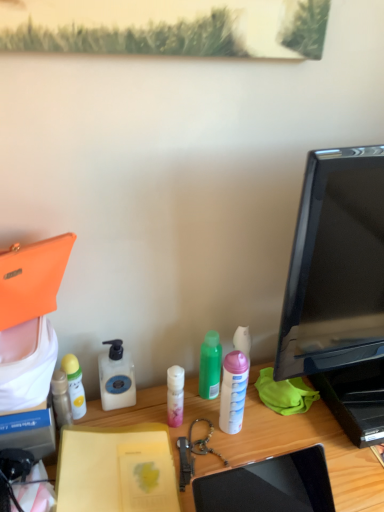
Question: Does point (354, 493) appear closer or farther from the camera than point (160, 477)?

Choices:
 (A) closer
 (B) farther

Answer: (B)

Question: In the image, is wooden desk at center positioned in front of or behind yellow matte notebook at center?

Choices:
 (A) front
 (B) behind

Answer: (A)

Question: Which is farther from the translucent plastic bottle at left, the 1th bottle when ordered from left to right?

Choices:
 (A) yellow matte bottle at left, acting as the 4th bottle starting from the right
 (B) white matte spray can at center, the 1th bottle from the right
 (C) white matte bottle at center, the third bottle viewed from the right
 (D) black glossy monitor at right
 (E) yellow matte notebook at center

Answer: (D)

Question: Which object is the closest to the translucent plastic bottle at left, the 1th bottle when ordered from left to right?

Choices:
 (A) yellow matte notebook at center
 (B) white matte spray can at center, arranged as the 5th bottle when viewed from the left
 (C) white matte bottle at center, the third bottle viewed from the right
 (D) green matte bottle at center, which is the 2th bottle in right-to-left order
 (E) black glossy monitor at right

Answer: (C)